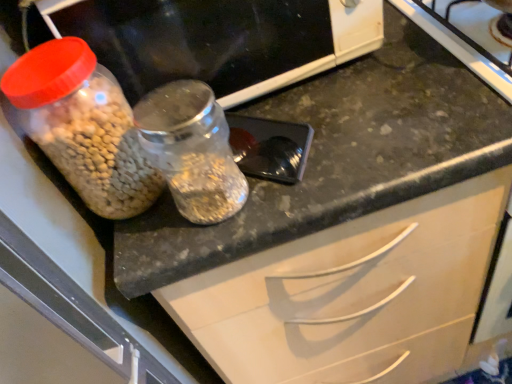
You are a GUI agent. You are given a task and a screenshot of the screen. Output one action in this format:
    pyautogui.click(x=<x>, y=<y>)
    Task: Click on the free space in front of translucent plastic jar at left
    The width and height of the screenshot is (512, 384).
    Given the screenshot: What is the action you would take?
    pyautogui.click(x=339, y=155)